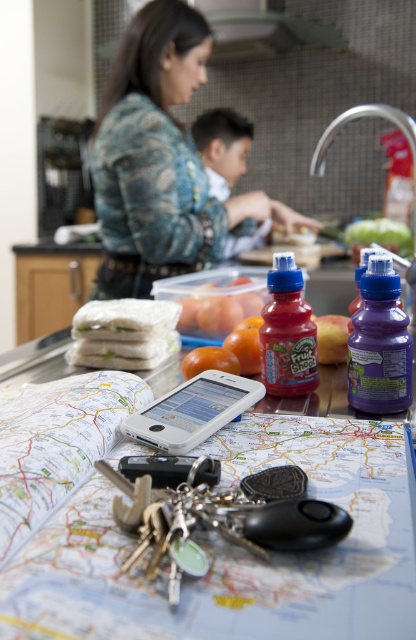
Identify the location of green leafy vegetable at upper right. (378, 234).

This screenshot has height=640, width=416. What do you see at coordinates (378, 234) in the screenshot?
I see `green leafy vegetable at upper right` at bounding box center [378, 234].

Image resolution: width=416 pixels, height=640 pixels. Find the location of `green leafy vegetable at upper right`. green leafy vegetable at upper right is located at coordinates (378, 234).

Between point (255, 381) and point (319, 349), which one is positioned in front?

Point (255, 381) is more forward.

Locate an element on the screen. white matte smartphone at center is located at coordinates (193, 410).

Measure the distance between white glossy map at center and camera.

The distance of white glossy map at center from camera is 10.27 inches.

Find the location of a particular element. This screenshot has height=640, width=416. white glossy map at center is located at coordinates (237, 550).

Is point (99, 625) positioned before point (296, 333)?

Yes, it is.

Where is `white glossy map at center`? This screenshot has width=416, height=640. white glossy map at center is located at coordinates (237, 550).